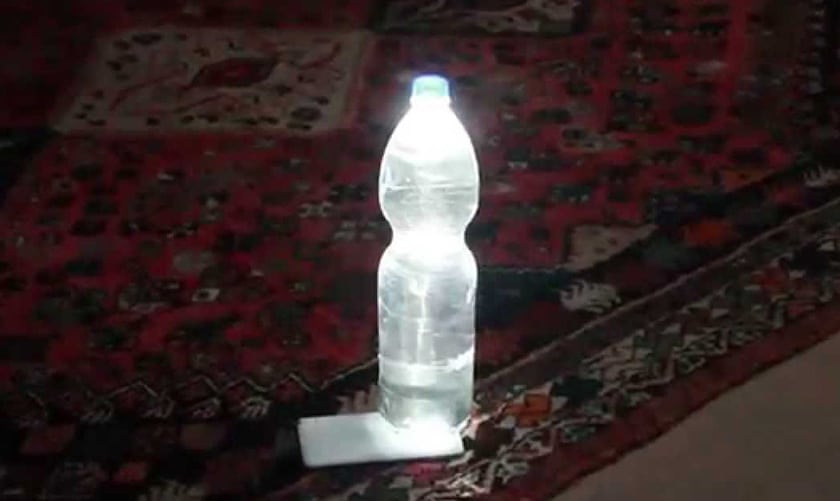
Image resolution: width=840 pixels, height=501 pixels. Identify the location of area rug. (543, 313).